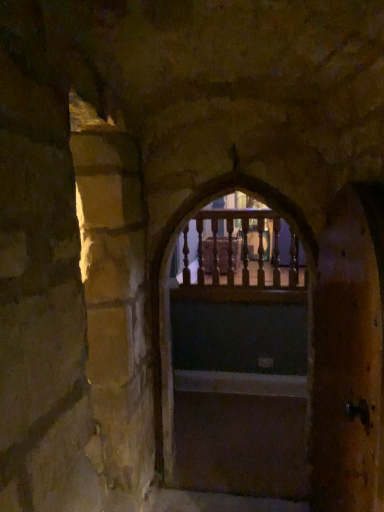
Question: In terms of width, does wooden railing at center look wider or thinner when compared to wooden railing at center?

Choices:
 (A) wide
 (B) thin

Answer: (A)

Question: Is wooden railing at center in front of or behind wooden railing at center in the image?

Choices:
 (A) behind
 (B) front

Answer: (B)

Question: Considering the real-world distances, which object is farthest from the wooden door at right?

Choices:
 (A) wooden railing at center
 (B) wooden railing at center
 (C) smooth wooden stairs at center

Answer: (B)

Question: Estimate the real-world distances between objects in this image. Which object is closer to the wooden railing at center?

Choices:
 (A) smooth wooden stairs at center
 (B) wooden door at right
 (C) wooden railing at center

Answer: (C)